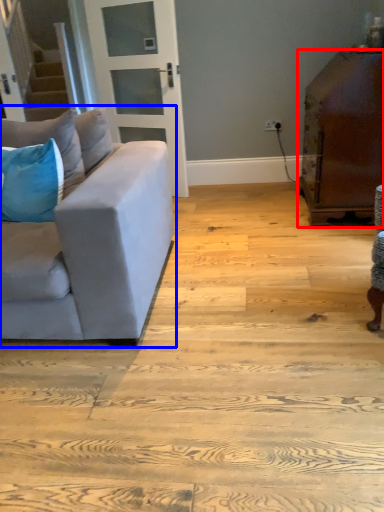
Question: Which of the following is the farthest to the observer, table (highlighted by a red box) or studio couch (highlighted by a blue box)?

Choices:
 (A) table
 (B) studio couch

Answer: (A)